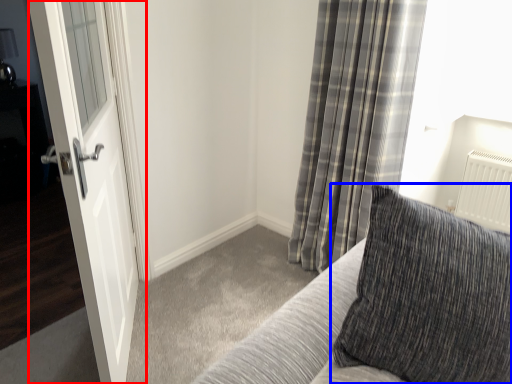
Question: Which of the following is the closest to the observer, door (highlighted by a red box) or pillow (highlighted by a blue box)?

Choices:
 (A) door
 (B) pillow

Answer: (B)